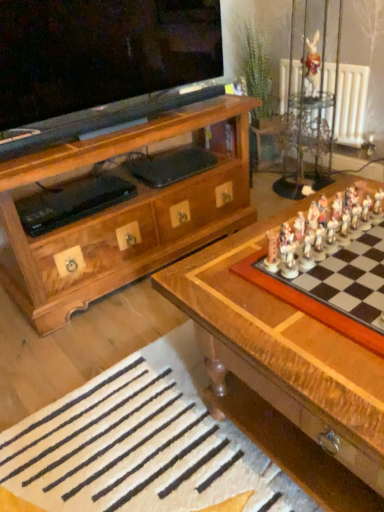
Question: Would you say white wool rug at lower center is to the left or to the right of wooden rabbit at upper right in the picture?

Choices:
 (A) left
 (B) right

Answer: (A)

Question: From a real-world perspective, is white wool rug at lower center positioned above or below wooden rabbit at upper right?

Choices:
 (A) below
 (B) above

Answer: (A)

Question: Which is nearer to the white wool rug at lower center?

Choices:
 (A) wooden chessboard at center
 (B) wooden chessboard at right
 (C) white painted radiator at upper right
 (D) wooden rabbit at upper right
 (E) clear glass vase at upper right

Answer: (A)

Question: Which is nearer to the wooden chessboard at center?

Choices:
 (A) wooden chessboard at right
 (B) white painted radiator at upper right
 (C) clear glass vase at upper right
 (D) wooden rabbit at upper right
 (E) white wool rug at lower center

Answer: (A)